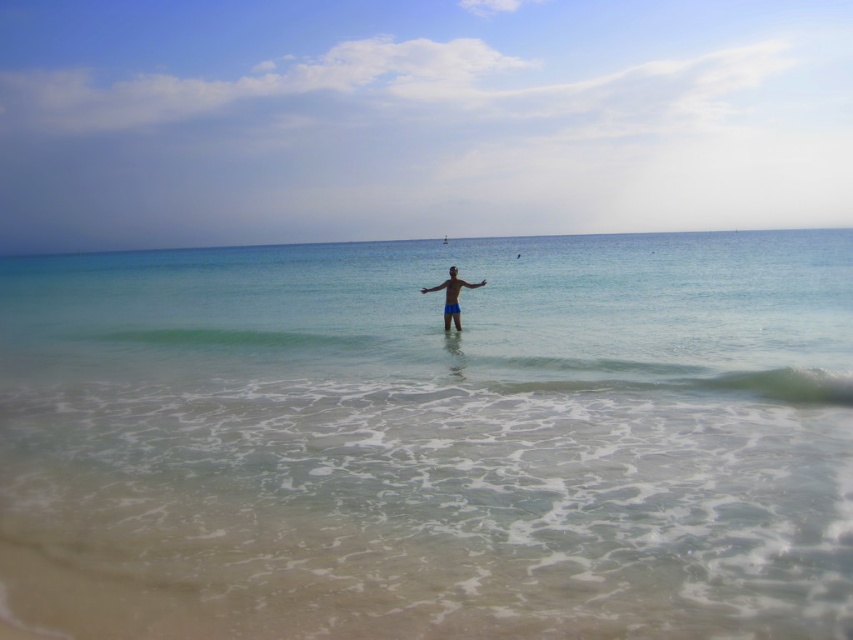
You are standing at the point with coordinates point (445, 314) and want to move towards the point with coordinates point (311, 532). Based on the scene description, will you be moving towards the shore or away from it?

Point (311, 532) is in front of point (445, 314). Since you are moving from point (445, 314) towards point (311, 532), you are moving away from the shore because the point (311, 532) is further out in the water compared to point (445, 314).

You are standing on the beach and see the clear blue water at center marked by point (432, 440). If you walk straight towards that point, will you enter the water first before reaching the boats in the distance?

The clear blue water at center is represented by point (432, 440). Since the boats are in the distance beyond the water, you will enter the water before reaching the boats.